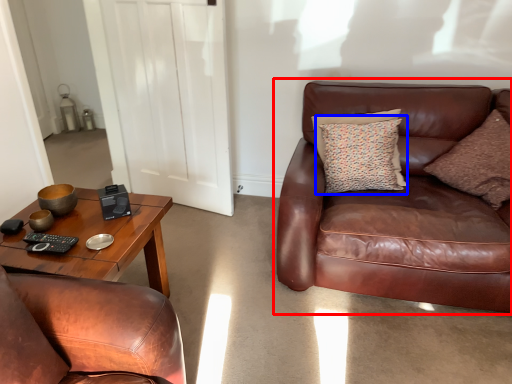
Question: Which of the following is the farthest to the observer, studio couch (highlighted by a red box) or pillow (highlighted by a blue box)?

Choices:
 (A) studio couch
 (B) pillow

Answer: (B)